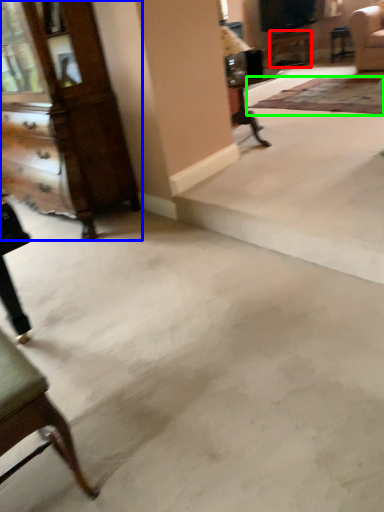
Question: Which is nearer to the table (highlighted by a red box)? dresser (highlighted by a blue box) or mat (highlighted by a green box).

Choices:
 (A) dresser
 (B) mat

Answer: (B)